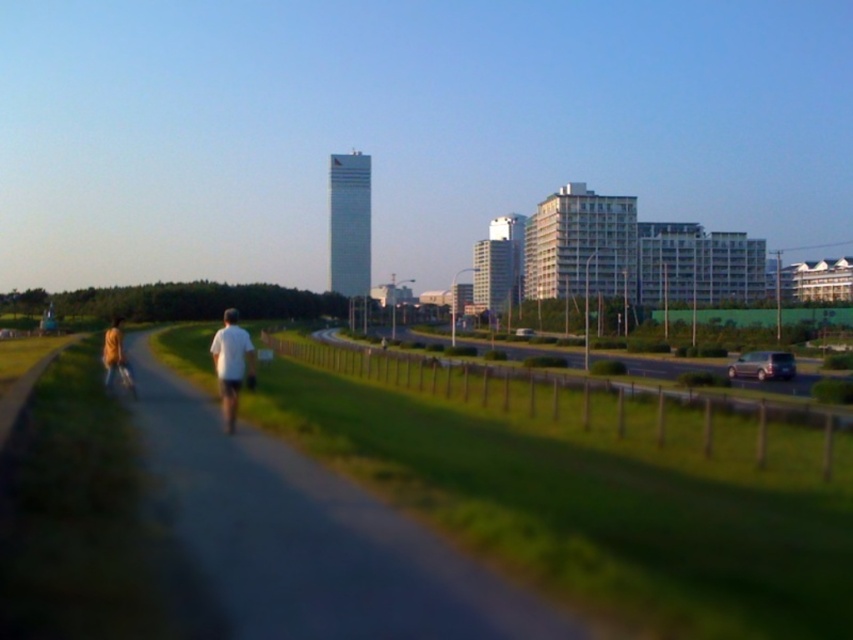
Can you confirm if gray asphalt path at center is smaller than white matte shirt at center?

Yes, gray asphalt path at center is smaller than white matte shirt at center.

Who is positioned more to the left, gray asphalt path at center or white matte shirt at center?

white matte shirt at center

Who is more forward, (x=479, y=586) or (x=242, y=337)?

Positioned in front is point (x=479, y=586).

Identify the location of gray asphalt path at center. Image resolution: width=853 pixels, height=640 pixels. (310, 538).